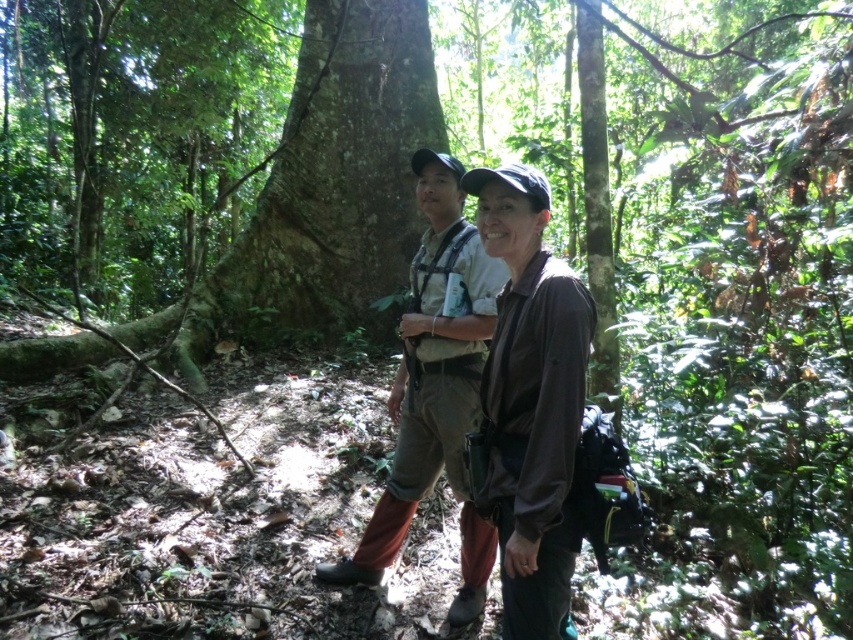
Is green rough bark tree at center smaller than brown matte shirt at center?

Incorrect, green rough bark tree at center is not smaller in size than brown matte shirt at center.

Measure the distance from green rough bark tree at center to brown matte shirt at center.

They are 3.97 meters apart.

Identify the location of green rough bark tree at center. (334, 179).

Does brown matte shirt at center appear on the left side of brown fabric jacket at center?

Incorrect, brown matte shirt at center is not on the left side of brown fabric jacket at center.

Does brown matte shirt at center have a greater height compared to brown fabric jacket at center?

No.

Describe the element at coordinates (531, 403) in the screenshot. The width and height of the screenshot is (853, 640). I see `brown matte shirt at center` at that location.

This screenshot has width=853, height=640. I want to click on brown matte shirt at center, so click(x=531, y=403).

Which is more to the left, green rough bark tree at center or brown fabric jacket at center?

green rough bark tree at center is more to the left.

Can you confirm if green rough bark tree at center is positioned to the left of brown fabric jacket at center?

Yes, green rough bark tree at center is to the left of brown fabric jacket at center.

Between point (370, 234) and point (461, 586), which one is positioned behind?

The point (370, 234) is more distant.

Identify the location of green rough bark tree at center. The image size is (853, 640). (334, 179).